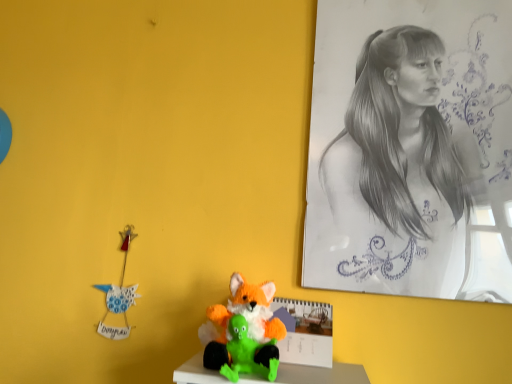
Question: Which direction should I rotate to look at fluffy orange and green plush toy at center, which ranks as the first toy in back-to-front order?

Choices:
 (A) right
 (B) left

Answer: (B)

Question: Should I look upward or downward to see graphite sketch at upper right?

Choices:
 (A) down
 (B) up

Answer: (B)

Question: Does fluffy orange fox at center, placed as the second toy when sorted from back to front, come behind graphite sketch at upper right?

Choices:
 (A) yes
 (B) no

Answer: (B)

Question: Can you confirm if fluffy orange fox at center, which is counted as the first toy, starting from the front, is positioned to the left of graphite sketch at upper right?

Choices:
 (A) yes
 (B) no

Answer: (A)

Question: Are fluffy orange fox at center, placed as the second toy when sorted from back to front, and graphite sketch at upper right located far from each other?

Choices:
 (A) yes
 (B) no

Answer: (B)

Question: Can you confirm if fluffy orange fox at center, placed as the second toy when sorted from back to front, is wider than graphite sketch at upper right?

Choices:
 (A) yes
 (B) no

Answer: (A)

Question: Is fluffy orange fox at center, placed as the second toy when sorted from back to front, bigger than graphite sketch at upper right?

Choices:
 (A) no
 (B) yes

Answer: (A)

Question: From the image's perspective, does fluffy orange fox at center, which is counted as the first toy, starting from the front, appear lower than graphite sketch at upper right?

Choices:
 (A) no
 (B) yes

Answer: (B)

Question: From a real-world perspective, is fluffy orange fox at center, which is counted as the first toy, starting from the front, beneath fluffy orange and green plush toy at center, which ranks as the first toy in back-to-front order?

Choices:
 (A) yes
 (B) no

Answer: (A)

Question: Is fluffy orange fox at center, placed as the second toy when sorted from back to front, wider than fluffy orange and green plush toy at center, which is counted as the second toy, starting from the front?

Choices:
 (A) yes
 (B) no

Answer: (B)

Question: Is fluffy orange fox at center, placed as the second toy when sorted from back to front, thinner than fluffy orange and green plush toy at center, which ranks as the first toy in back-to-front order?

Choices:
 (A) no
 (B) yes

Answer: (B)

Question: Is fluffy orange fox at center, which is counted as the first toy, starting from the front, at the left side of fluffy orange and green plush toy at center, which ranks as the first toy in back-to-front order?

Choices:
 (A) no
 (B) yes

Answer: (A)

Question: Is fluffy orange fox at center, which is counted as the first toy, starting from the front, closer to camera compared to fluffy orange and green plush toy at center, which is counted as the second toy, starting from the front?

Choices:
 (A) yes
 (B) no

Answer: (A)

Question: Is fluffy orange fox at center, placed as the second toy when sorted from back to front, further to the viewer compared to fluffy orange and green plush toy at center, which ranks as the first toy in back-to-front order?

Choices:
 (A) yes
 (B) no

Answer: (B)

Question: Is graphite sketch at upper right to the right of fluffy orange and green plush toy at center, which ranks as the first toy in back-to-front order, from the viewer's perspective?

Choices:
 (A) no
 (B) yes

Answer: (B)